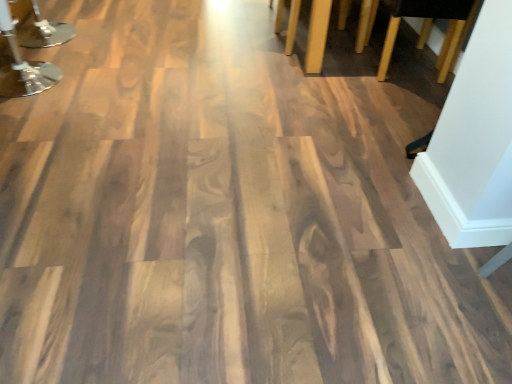
In order to face wooden table legs at upper right, acting as the 2th furniture starting from the left, should I rotate leftwards or rightwards?

Rotate right and turn 13.052 degrees.

Find the location of a particular element. Image resolution: width=512 pixels, height=384 pixels. wooden table legs at upper right, the first furniture in the right-to-left sequence is located at coordinates (429, 30).

What do you see at coordinates (429, 30) in the screenshot? The image size is (512, 384). I see `wooden table legs at upper right, the first furniture in the right-to-left sequence` at bounding box center [429, 30].

What do you see at coordinates (23, 66) in the screenshot?
I see `polished chrome table at upper left, marked as the 1th furniture in a left-to-right arrangement` at bounding box center [23, 66].

Image resolution: width=512 pixels, height=384 pixels. I want to click on polished chrome table at upper left, marked as the 1th furniture in a left-to-right arrangement, so click(23, 66).

This screenshot has width=512, height=384. I want to click on wooden table legs at upper right, the first furniture in the right-to-left sequence, so click(429, 30).

Considering the positions of objects polished chrome table at upper left, marked as the 1th furniture in a left-to-right arrangement, and wooden table legs at upper right, acting as the 2th furniture starting from the left, in the image provided, who is more to the left, polished chrome table at upper left, marked as the 1th furniture in a left-to-right arrangement, or wooden table legs at upper right, acting as the 2th furniture starting from the left,?

From the viewer's perspective, polished chrome table at upper left, marked as the 1th furniture in a left-to-right arrangement, appears more on the left side.

Which is behind, polished chrome table at upper left, arranged as the 2th furniture when viewed from the right, or wooden table legs at upper right, acting as the 2th furniture starting from the left?

wooden table legs at upper right, acting as the 2th furniture starting from the left, is more distant.

Is point (16, 78) positioned behind point (311, 36)?

No, (16, 78) is in front of (311, 36).

From the image's perspective, relative to wooden table legs at upper right, acting as the 2th furniture starting from the left, is polished chrome table at upper left, arranged as the 2th furniture when viewed from the right, above or below?

Clearly, from the image's perspective, polished chrome table at upper left, arranged as the 2th furniture when viewed from the right, is below wooden table legs at upper right, acting as the 2th furniture starting from the left.

From a real-world perspective, does polished chrome table at upper left, marked as the 1th furniture in a left-to-right arrangement, stand above wooden table legs at upper right, the first furniture in the right-to-left sequence?

Yes, from a real-world perspective, polished chrome table at upper left, marked as the 1th furniture in a left-to-right arrangement, is above wooden table legs at upper right, the first furniture in the right-to-left sequence.

Which of these two, polished chrome table at upper left, arranged as the 2th furniture when viewed from the right, or wooden table legs at upper right, acting as the 2th furniture starting from the left, is wider?

wooden table legs at upper right, acting as the 2th furniture starting from the left, is wider.

Is polished chrome table at upper left, marked as the 1th furniture in a left-to-right arrangement, shorter than wooden table legs at upper right, acting as the 2th furniture starting from the left?

In fact, polished chrome table at upper left, marked as the 1th furniture in a left-to-right arrangement, may be taller than wooden table legs at upper right, acting as the 2th furniture starting from the left.

Can you confirm if polished chrome table at upper left, marked as the 1th furniture in a left-to-right arrangement, is smaller than wooden table legs at upper right, the first furniture in the right-to-left sequence?

Indeed, polished chrome table at upper left, marked as the 1th furniture in a left-to-right arrangement, has a smaller size compared to wooden table legs at upper right, the first furniture in the right-to-left sequence.

Is polished chrome table at upper left, arranged as the 2th furniture when viewed from the right, surrounding wooden table legs at upper right, the first furniture in the right-to-left sequence?

Actually, wooden table legs at upper right, the first furniture in the right-to-left sequence, is outside polished chrome table at upper left, arranged as the 2th furniture when viewed from the right.

Is the surface of polished chrome table at upper left, arranged as the 2th furniture when viewed from the right, in direct contact with wooden table legs at upper right, acting as the 2th furniture starting from the left?

No, polished chrome table at upper left, arranged as the 2th furniture when viewed from the right, is not with wooden table legs at upper right, acting as the 2th furniture starting from the left.

From the picture: Is polished chrome table at upper left, arranged as the 2th furniture when viewed from the right, looking in the opposite direction of wooden table legs at upper right, the first furniture in the right-to-left sequence?

Yes, polished chrome table at upper left, arranged as the 2th furniture when viewed from the right,'s orientation is away from wooden table legs at upper right, the first furniture in the right-to-left sequence.

How different are the orientations of polished chrome table at upper left, arranged as the 2th furniture when viewed from the right, and wooden table legs at upper right, acting as the 2th furniture starting from the left, in degrees?

The facing directions of polished chrome table at upper left, arranged as the 2th furniture when viewed from the right, and wooden table legs at upper right, acting as the 2th furniture starting from the left, are 1.44 degrees apart.

Where is `furniture behind the polished chrome table at upper left, arranged as the 2th furniture when viewed from the right`? This screenshot has height=384, width=512. furniture behind the polished chrome table at upper left, arranged as the 2th furniture when viewed from the right is located at coordinates (429, 30).

Does wooden table legs at upper right, acting as the 2th furniture starting from the left, appear on the right side of polished chrome table at upper left, marked as the 1th furniture in a left-to-right arrangement?

Indeed, wooden table legs at upper right, acting as the 2th furniture starting from the left, is positioned on the right side of polished chrome table at upper left, marked as the 1th furniture in a left-to-right arrangement.

Considering the positions of objects wooden table legs at upper right, acting as the 2th furniture starting from the left, and polished chrome table at upper left, arranged as the 2th furniture when viewed from the right, in the image provided, who is in front, wooden table legs at upper right, acting as the 2th furniture starting from the left, or polished chrome table at upper left, arranged as the 2th furniture when viewed from the right,?

polished chrome table at upper left, arranged as the 2th furniture when viewed from the right, is in front.

Does point (312, 21) appear closer or farther from the camera than point (45, 68)?

Point (312, 21) is closer to the camera than point (45, 68).

From the image's perspective, which one is positioned lower, wooden table legs at upper right, the first furniture in the right-to-left sequence, or polished chrome table at upper left, marked as the 1th furniture in a left-to-right arrangement?

polished chrome table at upper left, marked as the 1th furniture in a left-to-right arrangement, appears lower in the image.

From a real-world perspective, is wooden table legs at upper right, acting as the 2th furniture starting from the left, positioned under polished chrome table at upper left, arranged as the 2th furniture when viewed from the right, based on gravity?

Correct, in the physical world, wooden table legs at upper right, acting as the 2th furniture starting from the left, is lower than polished chrome table at upper left, arranged as the 2th furniture when viewed from the right.

Looking at this image, which of these two, wooden table legs at upper right, acting as the 2th furniture starting from the left, or polished chrome table at upper left, arranged as the 2th furniture when viewed from the right, is wider?

wooden table legs at upper right, acting as the 2th furniture starting from the left, is wider.

Which of these two, wooden table legs at upper right, acting as the 2th furniture starting from the left, or polished chrome table at upper left, marked as the 1th furniture in a left-to-right arrangement, stands taller?

polished chrome table at upper left, marked as the 1th furniture in a left-to-right arrangement.

Considering the sizes of objects wooden table legs at upper right, acting as the 2th furniture starting from the left, and polished chrome table at upper left, marked as the 1th furniture in a left-to-right arrangement, in the image provided, who is bigger, wooden table legs at upper right, acting as the 2th furniture starting from the left, or polished chrome table at upper left, marked as the 1th furniture in a left-to-right arrangement,?

With larger size is wooden table legs at upper right, acting as the 2th furniture starting from the left.

Is wooden table legs at upper right, acting as the 2th furniture starting from the left, positioned beyond the bounds of polished chrome table at upper left, arranged as the 2th furniture when viewed from the right?

wooden table legs at upper right, acting as the 2th furniture starting from the left, is positioned outside polished chrome table at upper left, arranged as the 2th furniture when viewed from the right.

Consider the image. Is wooden table legs at upper right, the first furniture in the right-to-left sequence, positioned far away from polished chrome table at upper left, marked as the 1th furniture in a left-to-right arrangement?

Yes, wooden table legs at upper right, the first furniture in the right-to-left sequence, and polished chrome table at upper left, marked as the 1th furniture in a left-to-right arrangement, are located far from each other.

Is wooden table legs at upper right, the first furniture in the right-to-left sequence, oriented towards polished chrome table at upper left, marked as the 1th furniture in a left-to-right arrangement?

Yes, wooden table legs at upper right, the first furniture in the right-to-left sequence, faces towards polished chrome table at upper left, marked as the 1th furniture in a left-to-right arrangement.

The width and height of the screenshot is (512, 384). What are the coordinates of `furniture below the polished chrome table at upper left, marked as the 1th furniture in a left-to-right arrangement (from a real-world perspective)` in the screenshot? It's located at tap(429, 30).

Find the location of a particular element. Image resolution: width=512 pixels, height=384 pixels. furniture above the wooden table legs at upper right, acting as the 2th furniture starting from the left (from a real-world perspective) is located at coordinates pyautogui.click(x=23, y=66).

This screenshot has width=512, height=384. I want to click on furniture below the wooden table legs at upper right, acting as the 2th furniture starting from the left (from the image's perspective), so click(x=23, y=66).